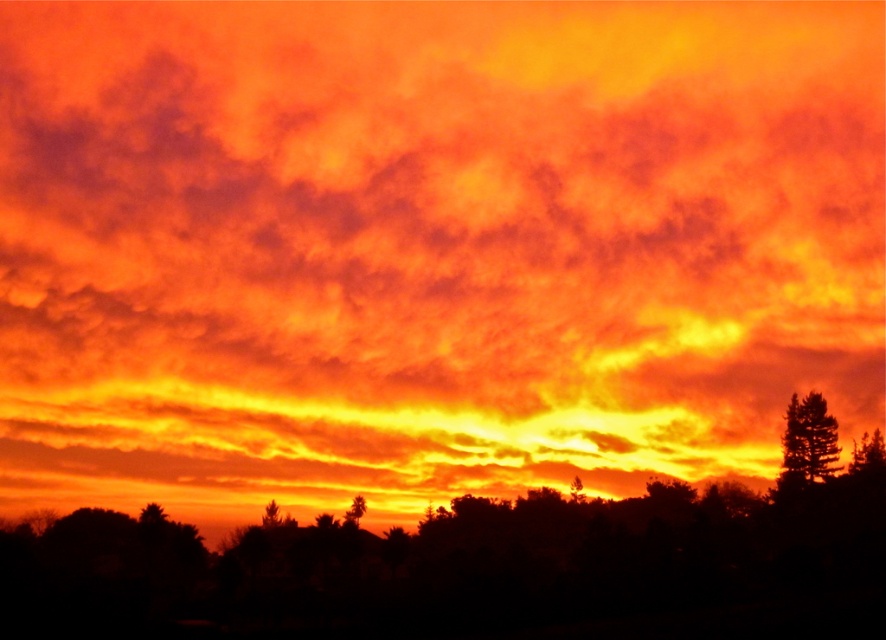
Question: Which object is the closest to the green leafy tree at center?

Choices:
 (A) silhouette tree at center
 (B) silhouette tree at lower center
 (C) silky brown pine tree at right

Answer: (B)

Question: Does green leafy tree at center lie in front of silhouette tree at lower center?

Choices:
 (A) yes
 (B) no

Answer: (A)

Question: From the image, what is the correct spatial relationship of silhouette tree at center in relation to green leafy tree at center?

Choices:
 (A) left
 (B) right

Answer: (B)

Question: Which object is closer to the camera taking this photo?

Choices:
 (A) silhouette tree at center
 (B) green leafy tree at center

Answer: (A)

Question: Is silky brown pine tree at right smaller than silhouette tree at lower center?

Choices:
 (A) no
 (B) yes

Answer: (A)

Question: Which of the following is the closest to the observer?

Choices:
 (A) (795, 392)
 (B) (270, 502)
 (C) (356, 500)

Answer: (B)